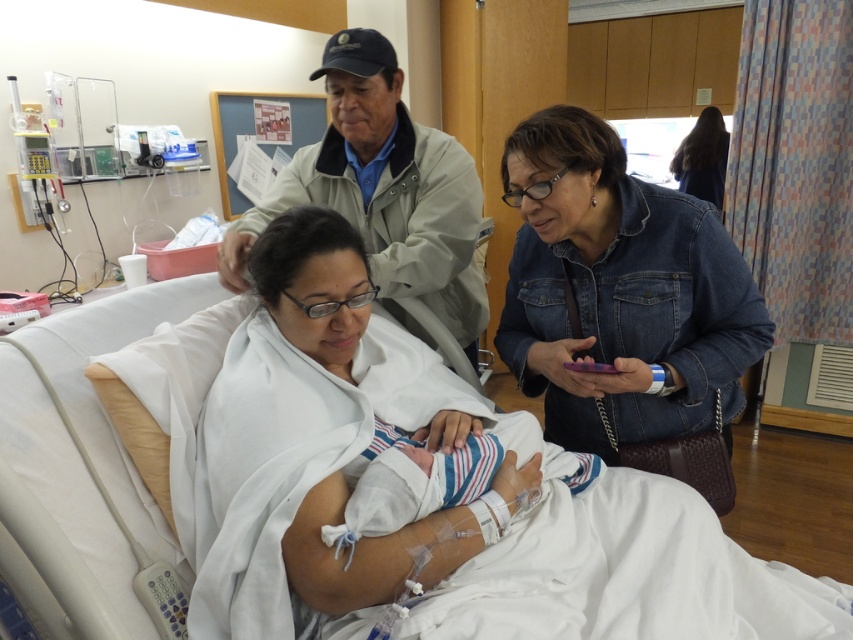
From the picture: You are a photographer in the hospital room. You need to take a photo of the khaki jacket at upper center and dark brown hair at upper right. Which object should you focus on first if you want to capture both in the frame without moving the camera?

You should focus on the khaki jacket at upper center first because it is positioned on the left side of the dark brown hair at upper right, so capturing it first ensures both are in the frame.